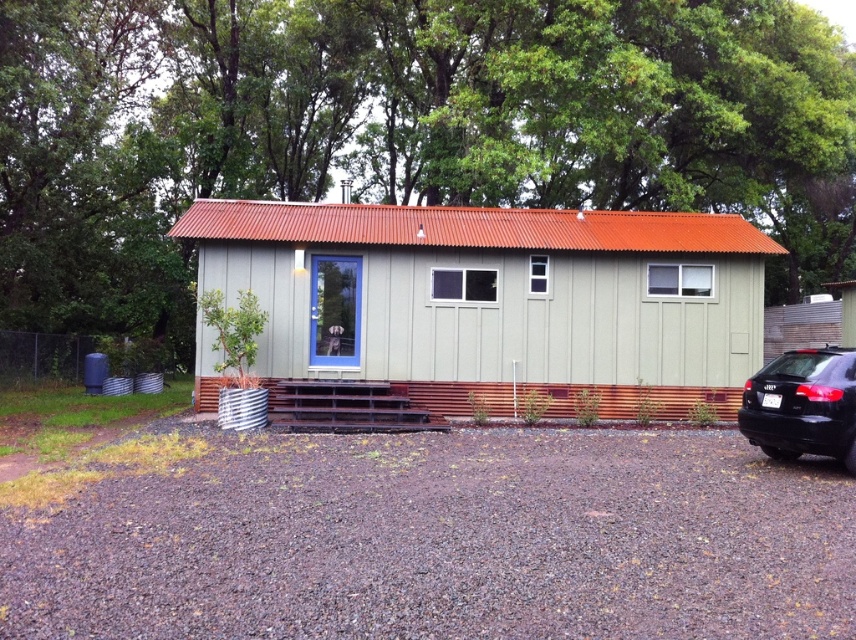
Question: Does green leafy tree at upper center appear under green corrugated metal hut at center?

Choices:
 (A) no
 (B) yes

Answer: (A)

Question: Estimate the real-world distances between objects in this image. Which object is farther from the black glossy sedan at lower right?

Choices:
 (A) green corrugated metal hut at center
 (B) green leafy tree at upper center

Answer: (B)

Question: Which object appears closest to the camera in this image?

Choices:
 (A) black glossy sedan at lower right
 (B) green corrugated metal hut at center

Answer: (A)

Question: Observing the image, what is the correct spatial positioning of green leafy tree at upper center in reference to green corrugated metal hut at center?

Choices:
 (A) left
 (B) right

Answer: (B)

Question: From the image, what is the correct spatial relationship of green leafy tree at upper center in relation to green corrugated metal hut at center?

Choices:
 (A) left
 (B) right

Answer: (B)

Question: Which of these objects is positioned farthest from the green leafy tree at upper center?

Choices:
 (A) black glossy sedan at lower right
 (B) green corrugated metal hut at center

Answer: (A)